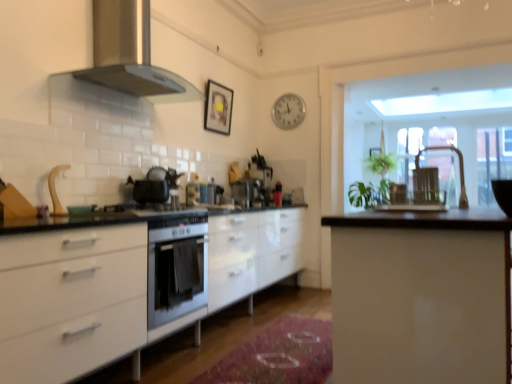
Find the location of a particular element. This screenshot has width=512, height=384. free spot above rug at center (from a real-world perspective) is located at coordinates (276, 352).